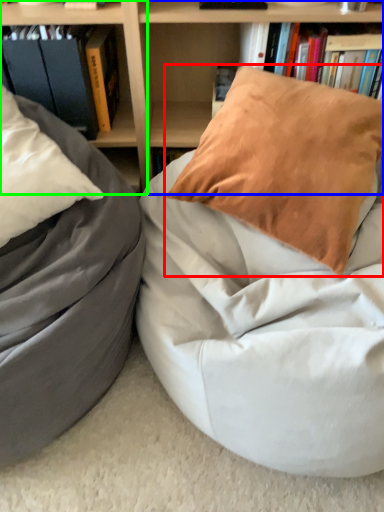
Question: Which is nearer to the pillow (highlighted by a red box)? bookcase (highlighted by a blue box) or shelf (highlighted by a green box).

Choices:
 (A) bookcase
 (B) shelf

Answer: (A)